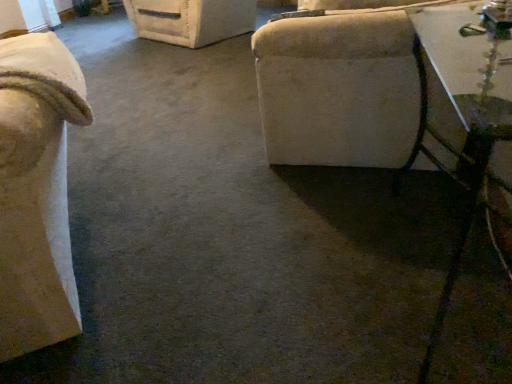
This screenshot has width=512, height=384. What do you see at coordinates (469, 126) in the screenshot?
I see `metallic dark brown table at right` at bounding box center [469, 126].

The height and width of the screenshot is (384, 512). I want to click on metallic dark brown table at right, so click(x=469, y=126).

What is the approximate height of metallic dark brown table at right?

metallic dark brown table at right is 28.51 inches tall.

You are a GUI agent. You are given a task and a screenshot of the screen. Output one action in this format:
    pyautogui.click(x=<x>, y=<y>)
    Task: Click on the metallic dark brown table at right
    
    Given the screenshot: What is the action you would take?
    pyautogui.click(x=469, y=126)